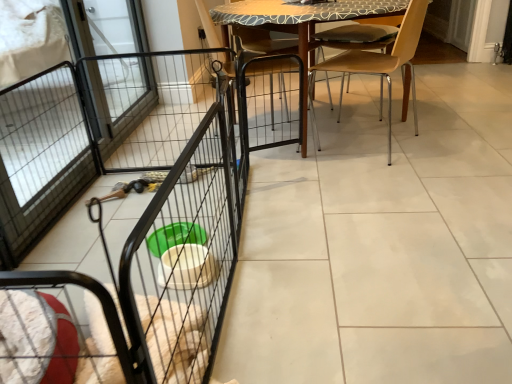
Identify the location of vacant area located to the right-hand side of black wire cage at center. (389, 241).